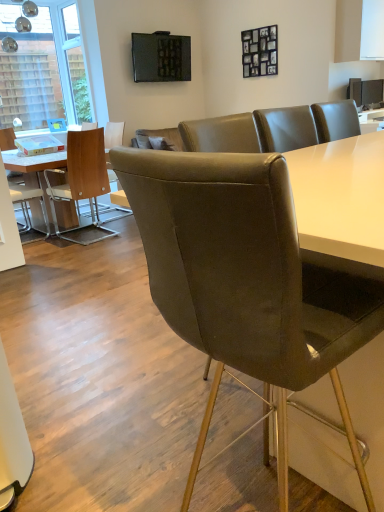
Looking at this image, measure the distance between brown leather chair at center, which appears as the 3th chair when viewed from the left, and camera.

20.51 inches.

The height and width of the screenshot is (512, 384). What do you see at coordinates (365, 91) in the screenshot?
I see `matte black tv at upper center, which is counted as the 2th television, starting from the top` at bounding box center [365, 91].

Locate an element on the screen. brown leather chair at center, the first chair in the front-to-back sequence is located at coordinates (246, 281).

Which object is positioned more to the left, white leather chair at left, which ranks as the 3th chair in right-to-left order, or matte brown chair at left, the second chair from the right?

From the viewer's perspective, white leather chair at left, which ranks as the 3th chair in right-to-left order, appears more on the left side.

From a real-world perspective, which object rests below the other?

white leather chair at left, which ranks as the 3th chair in right-to-left order, is physically lower.

Consider the image. Which object is wider, white leather chair at left, placed as the third chair when sorted from front to back, or matte brown chair at left, which appears as the 2th chair when viewed from the left?

With larger width is matte brown chair at left, which appears as the 2th chair when viewed from the left.

Is transparent glass window at upper left oriented towards matte black tv at upper center, positioned as the 1th television in left-to-right order?

No, transparent glass window at upper left is not aimed at matte black tv at upper center, positioned as the 1th television in left-to-right order.

Identify the location of window on the left side of matte black tv at upper center, positioned as the 1th television in left-to-right order. (62, 54).

How different are the orientations of transparent glass window at upper left and matte black tv at upper center, which is counted as the first television, starting from the top, in degrees?

There is a 1.19-degree angle between the facing directions of transparent glass window at upper left and matte black tv at upper center, which is counted as the first television, starting from the top.

In the scene shown: From the image's perspective, which one is positioned higher, transparent glass window at upper left or brown leather chair at center, which appears as the 3th chair when viewed from the left?

transparent glass window at upper left, from the image's perspective.

From a real-world perspective, is transparent glass window at upper left above or below brown leather chair at center, the 1th chair from the right?

transparent glass window at upper left is situated higher than brown leather chair at center, the 1th chair from the right, in the real world.

In terms of size, does transparent glass window at upper left appear bigger or smaller than brown leather chair at center, which appears as the 3th chair when viewed from the left?

In the image, transparent glass window at upper left appears to be smaller than brown leather chair at center, which appears as the 3th chair when viewed from the left.

Between transparent glass window at upper left and brown leather chair at center, the first chair in the front-to-back sequence, which one is positioned behind?

transparent glass window at upper left.

Is the depth of matte black tv at upper center, positioned as the 2th television in left-to-right order, greater than that of brown leather chair at center, the 1th chair from the right?

Yes.

From the image's perspective, which one is positioned lower, matte black tv at upper center, positioned as the 2th television in left-to-right order, or brown leather chair at center, which is counted as the 3th chair, starting from the back?

From the image's view, brown leather chair at center, which is counted as the 3th chair, starting from the back, is below.

Which object is thinner, matte black tv at upper center, which is counted as the 2th television, starting from the top, or brown leather chair at center, which appears as the 3th chair when viewed from the left?

matte black tv at upper center, which is counted as the 2th television, starting from the top, is thinner.

How many degrees apart are the facing directions of matte black tv at upper center, positioned as the 2th television in left-to-right order, and brown leather chair at center, the first chair in the front-to-back sequence?

The facing directions of matte black tv at upper center, positioned as the 2th television in left-to-right order, and brown leather chair at center, the first chair in the front-to-back sequence, are 12 degrees apart.

From a real-world perspective, is matte brown chair at left, placed as the 2th chair when sorted from front to back, on top of matte black tv at upper center, which is counted as the 2th television, starting from the top?

No, from a real-world perspective, matte brown chair at left, placed as the 2th chair when sorted from front to back, is not over matte black tv at upper center, which is counted as the 2th television, starting from the top

This screenshot has height=512, width=384. In order to click on chair that is the 2nd object to the left of the matte black tv at upper center, the first television from the right, starting at the anchor in this screenshot , I will do `click(82, 180)`.

Does matte brown chair at left, the second chair from the right, have a greater width compared to matte black tv at upper center, which is counted as the 2th television, starting from the top?

Indeed, matte brown chair at left, the second chair from the right, has a greater width compared to matte black tv at upper center, which is counted as the 2th television, starting from the top.

Which is behind, point (163, 41) or point (100, 167)?

The point (163, 41) is farther.

Consider the image. From the image's perspective, is matte black tv at upper center, which is counted as the first television, starting from the top, positioned above or below matte brown chair at left, the second chair when ordered from back to front?

Clearly, from the image's perspective, matte black tv at upper center, which is counted as the first television, starting from the top, is above matte brown chair at left, the second chair when ordered from back to front.

From a real-world perspective, is matte black tv at upper center, the second television in the right-to-left sequence, on top of matte brown chair at left, the second chair from the right?

Correct, in the physical world, matte black tv at upper center, the second television in the right-to-left sequence, is higher than matte brown chair at left, the second chair from the right.

Looking at this image, is matte brown chair at left, which appears as the 2th chair when viewed from the left, smaller than brown leather chair at center, the first chair in the front-to-back sequence?

Yes, matte brown chair at left, which appears as the 2th chair when viewed from the left, is smaller than brown leather chair at center, the first chair in the front-to-back sequence.

Does point (75, 193) lie in front of point (157, 306)?

No, (75, 193) is further to viewer.

Is brown leather chair at center, which is counted as the 3th chair, starting from the back, a part of matte brown chair at left, which appears as the 2th chair when viewed from the left?

No, brown leather chair at center, which is counted as the 3th chair, starting from the back, is located outside of matte brown chair at left, which appears as the 2th chair when viewed from the left.

The height and width of the screenshot is (512, 384). What are the coordinates of `the 1st chair in front when counting from the white leather chair at left, the 1th chair when ordered from left to right` in the screenshot? It's located at (82, 180).

You are a GUI agent. You are given a task and a screenshot of the screen. Output one action in this format:
    pyautogui.click(x=<x>, y=<y>)
    Task: Click on the window lying behind the matte black tv at upper center, positioned as the 1th television in left-to-right order
    
    Given the screenshot: What is the action you would take?
    pyautogui.click(x=62, y=54)

Estimate the real-world distances between objects in this image. Which object is closer to matte black tv at upper center, which is counted as the first television, starting from the top, matte brown chair at left, the second chair from the right, or brown leather chair at center, which appears as the 3th chair when viewed from the left?

Among the two, matte brown chair at left, the second chair from the right, is located nearer to matte black tv at upper center, which is counted as the first television, starting from the top.

Looking at this image, looking at the image, which one is located closer to brown leather chair at center, which is counted as the 3th chair, starting from the back, transparent glass window at upper left or matte black tv at upper center, the 1th television when ordered from bottom to top?

The object closer to brown leather chair at center, which is counted as the 3th chair, starting from the back, is transparent glass window at upper left.

Estimate the real-world distances between objects in this image. Which object is further from transparent glass window at upper left, matte black tv at upper center, the 1th television when ordered from bottom to top, or matte brown chair at left, the second chair when ordered from back to front?

matte black tv at upper center, the 1th television when ordered from bottom to top, is further to transparent glass window at upper left.

When comparing their distances from white leather chair at left, placed as the third chair when sorted from front to back, does matte brown chair at left, the second chair from the right, or brown leather chair at center, which appears as the 3th chair when viewed from the left, seem further?

brown leather chair at center, which appears as the 3th chair when viewed from the left.

Estimate the real-world distances between objects in this image. Which object is further from transparent glass window at upper left, white leather chair at left, placed as the third chair when sorted from front to back, or matte brown chair at left, the second chair when ordered from back to front?

white leather chair at left, placed as the third chair when sorted from front to back, is positioned further to the anchor transparent glass window at upper left.

Based on their spatial positions, is white leather chair at left, placed as the third chair when sorted from front to back, or matte black tv at upper center, the second television in the right-to-left sequence, closer to brown leather chair at center, which is counted as the 3th chair, starting from the back?

Among the two, white leather chair at left, placed as the third chair when sorted from front to back, is located nearer to brown leather chair at center, which is counted as the 3th chair, starting from the back.

Which object lies further to the anchor point matte brown chair at left, placed as the 2th chair when sorted from front to back, matte black tv at upper center, positioned as the 2th television in left-to-right order, or transparent glass window at upper left?

matte black tv at upper center, positioned as the 2th television in left-to-right order, is positioned further to the anchor matte brown chair at left, placed as the 2th chair when sorted from front to back.

Estimate the real-world distances between objects in this image. Which object is further from matte black tv at upper center, which is counted as the first television, starting from the top, transparent glass window at upper left or matte brown chair at left, the second chair when ordered from back to front?

matte brown chair at left, the second chair when ordered from back to front, is positioned further to the anchor matte black tv at upper center, which is counted as the first television, starting from the top.

The image size is (384, 512). Identify the location of television located between transparent glass window at upper left and matte black tv at upper center, the 1th television when ordered from bottom to top, in the left-right direction. (161, 57).

At what (x,y) coordinates should I click in order to perform the action: click on television between brown leather chair at center, the 1th chair from the right, and matte black tv at upper center, the 1th television when ordered from bottom to top, in the front-back direction. Please return your answer as a coordinate pair (x, y). This screenshot has height=512, width=384. Looking at the image, I should click on (161, 57).

Image resolution: width=384 pixels, height=512 pixels. What are the coordinates of `chair between brown leather chair at center, which is counted as the 3th chair, starting from the back, and white leather chair at left, placed as the first chair when sorted from back to front, in the front-back direction` in the screenshot? It's located at (82, 180).

Find the location of `television situated between matte brown chair at left, placed as the 2th chair when sorted from front to back, and matte black tv at upper center, which is counted as the 2th television, starting from the top, from left to right`. television situated between matte brown chair at left, placed as the 2th chair when sorted from front to back, and matte black tv at upper center, which is counted as the 2th television, starting from the top, from left to right is located at coordinates (161, 57).